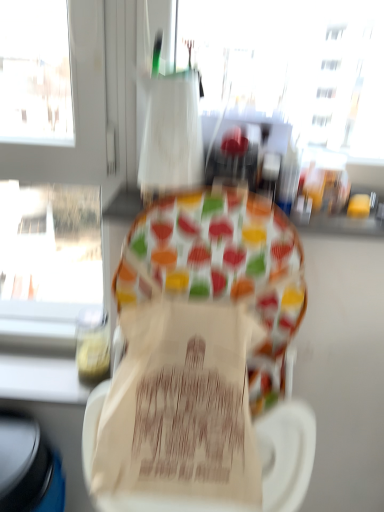
Describe the element at coordinates (41, 379) in the screenshot. I see `matte glass window sill at lower left` at that location.

Identify the location of matte glass window sill at lower left. [x=41, y=379].

You are a GUI agent. You are given a task and a screenshot of the screen. Output one action in this format:
    pyautogui.click(x=<x>, y=<y>)
    Task: Click on the matte glass window sill at lower left
    The width and height of the screenshot is (384, 512).
    Given the screenshot: What is the action you would take?
    pyautogui.click(x=41, y=379)